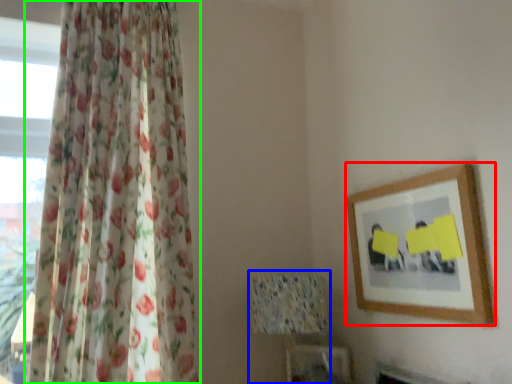
Question: Which object is positioned farthest from picture frame (highlighted by a red box)? Select from table lamp (highlighted by a blue box) and curtain (highlighted by a green box).

Choices:
 (A) table lamp
 (B) curtain

Answer: (B)